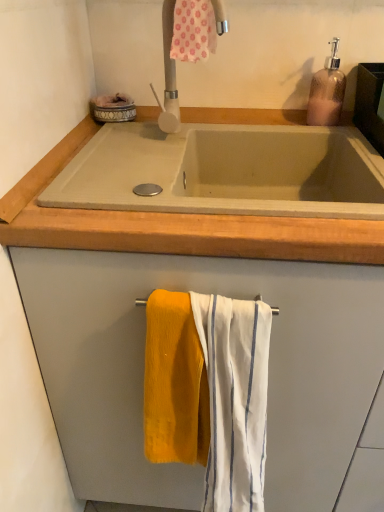
Question: Considering their positions, is soft yellow towel at lower center, acting as the second bath towel starting from the top, located in front of or behind translucent brown soap dispenser at upper right?

Choices:
 (A) front
 (B) behind

Answer: (A)

Question: Does point (162, 423) appear closer or farther from the camera than point (329, 103)?

Choices:
 (A) farther
 (B) closer

Answer: (B)

Question: Estimate the real-world distances between objects in this image. Which object is farther from the white matte tap at upper center?

Choices:
 (A) white striped fabric at center, the 3th bath towel positioned from the top
 (B) concrete sink at center
 (C) translucent brown soap dispenser at upper right
 (D) soft yellow towel at lower center, acting as the second bath towel starting from the top
 (E) pink floral fabric at upper center, marked as the 3th bath towel in a bottom-to-top arrangement

Answer: (A)

Question: Considering the real-world distances, which object is farthest from the white matte tap at upper center?

Choices:
 (A) pink floral fabric at upper center, which ranks as the first bath towel in top-to-bottom order
 (B) translucent brown soap dispenser at upper right
 (C) soft yellow towel at lower center, acting as the second bath towel starting from the top
 (D) concrete sink at center
 (E) white striped fabric at center, the 3th bath towel positioned from the top

Answer: (E)